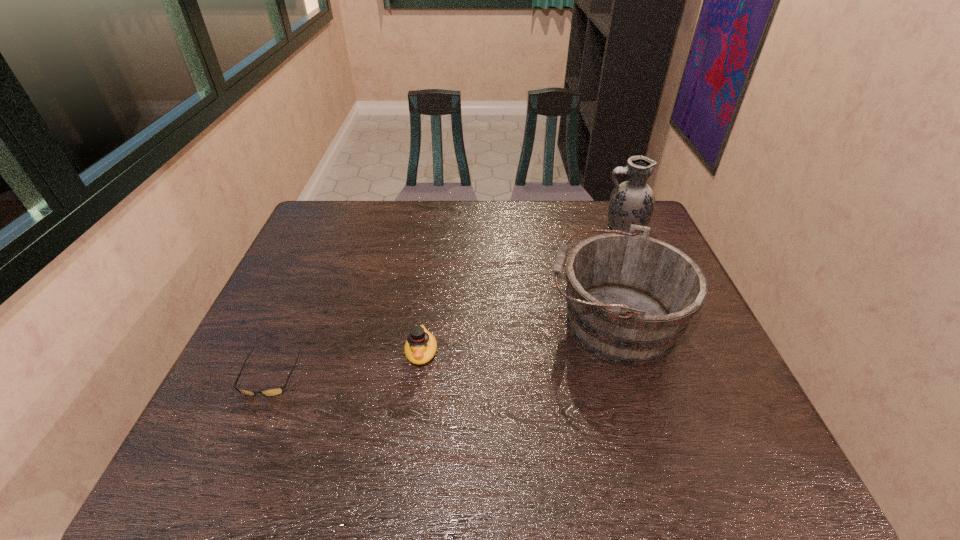
Identify which object is located as the third nearest to the second shortest object. Please provide its 2D coordinates. Your answer should be formatted as a tuple, i.e. [(x, y)], where the tuple contains the x and y coordinates of a point satisfying the conditions above.

[(632, 202)]

In order to click on object that is the closest one to the tallest object in this screenshot , I will do `click(629, 297)`.

At what (x,y) coordinates should I click in order to perform the action: click on free location that satisfies the following two spatial constraints: 1. on the back side of the wine bucket; 2. with the handle on the side of the tallest object. Please return your answer as a coordinate pair (x, y). Looking at the image, I should click on (584, 227).